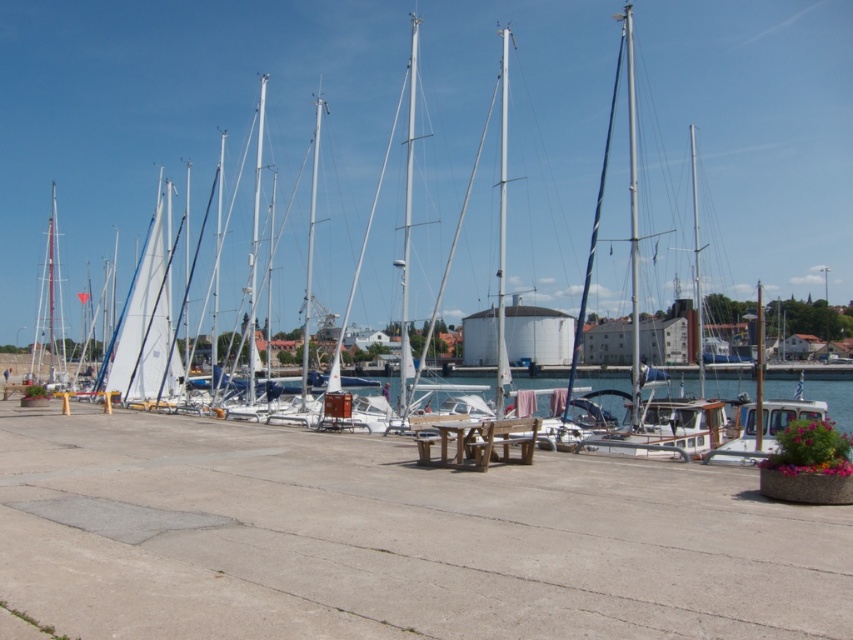
You are a photographer planning to take a photo of the silver metallic mast at center and the white matte mast at center. Since you want to ensure both masts are fully visible in your shot, which mast should you focus on first considering their positions?

The silver metallic mast at center is positioned under the white matte mast at center. To ensure both are fully visible, focus on the white matte mast at center first as it is above and might obscure part of the lower mast if not framed properly.

You are standing at the picnic table near the edge of the pier and want to know which mast is closer to you. The masts are the white matte mast at center and the white metallic mast at center. Can you determine which one is closer?

The white metallic mast at center is closer to you because the white matte mast at center is to the right of it, implying it is further away.

You are planning to move a large cooler onto the picnic table near the edge of the pier. The cooler is wider than the white glossy mast at center. Can the cooler fit on the picnic table if the white matte sailboat at center is already occupying space on it?

The white matte sailboat at center is wider than the white glossy mast at center. Since the cooler is wider than the mast, it would also be wider than the sailboat. Therefore, if the sailboat is already on the picnic table, the cooler may not fit unless there is additional space available.